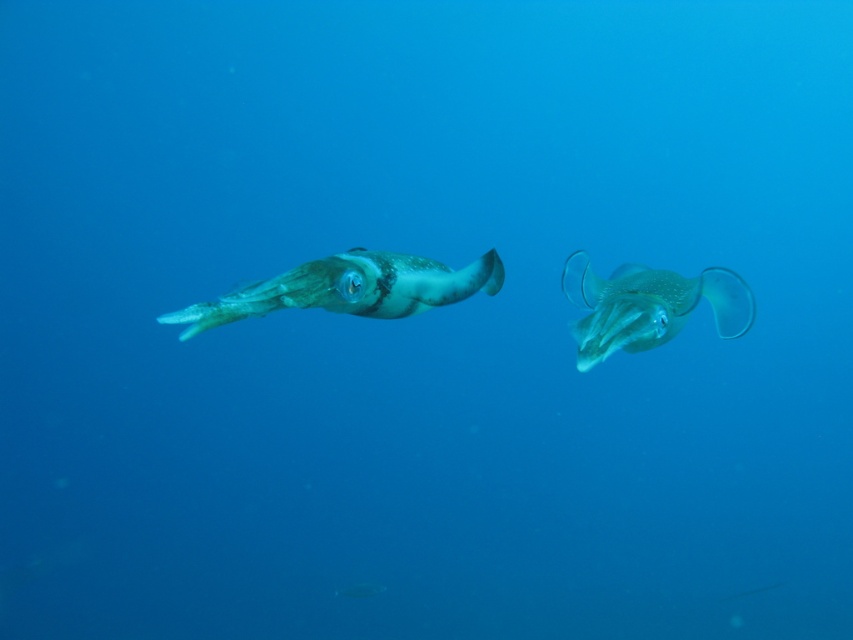
Question: Can you confirm if translucent green squid at left is wider than translucent rubber squid at center?

Choices:
 (A) yes
 (B) no

Answer: (A)

Question: Is translucent green squid at left bigger than translucent rubber squid at center?

Choices:
 (A) yes
 (B) no

Answer: (B)

Question: Can you confirm if translucent green squid at left is positioned to the left of translucent rubber squid at center?

Choices:
 (A) no
 (B) yes

Answer: (B)

Question: Which of the following is the farthest from the observer?

Choices:
 (A) translucent rubber squid at center
 (B) translucent green squid at left

Answer: (A)